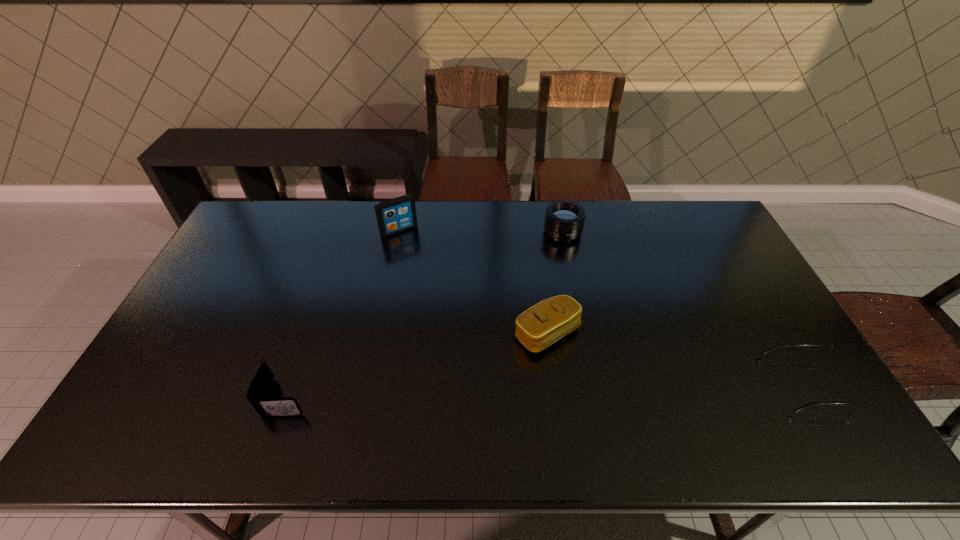
At what (x,y) coordinates should I click in order to perform the action: click on spectacles that is at the near edge. Please return your answer as a coordinate pair (x, y). This screenshot has width=960, height=540. Looking at the image, I should click on (856, 393).

This screenshot has height=540, width=960. Find the location of `object that is at the right edge`. object that is at the right edge is located at coordinates (856, 393).

Identify the location of object present at the near right corner. (856, 393).

This screenshot has width=960, height=540. In the image, there is a desktop. Identify the location of vacant space at the far edge. (436, 223).

Identify the location of free space at the near edge of the desktop. The height and width of the screenshot is (540, 960). (221, 394).

Where is `vacant space at the right edge of the desktop`? vacant space at the right edge of the desktop is located at coordinates (703, 255).

Find the location of a particular element. The width and height of the screenshot is (960, 540). free space at the far left corner is located at coordinates (253, 207).

Find the location of a particular element. This screenshot has height=540, width=960. vacant space at the near left corner of the desktop is located at coordinates (174, 383).

Find the location of a particular element. This screenshot has width=960, height=540. vacant space at the near right corner of the desktop is located at coordinates (775, 408).

Find the location of a particular element. This screenshot has height=540, width=960. vacant area between the spectacles and the telephoto lens is located at coordinates (685, 308).